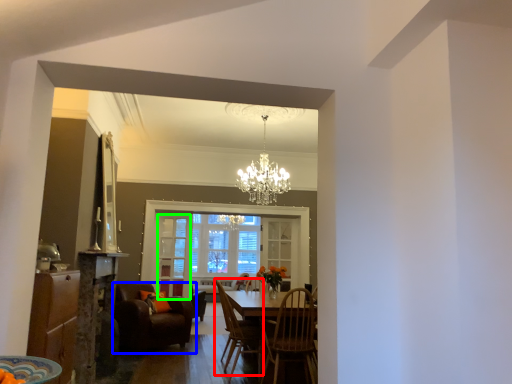
Question: Based on their relative distances, which object is farther from chair (highlighted by a red box)? Choose from chair (highlighted by a blue box) and glass door (highlighted by a green box).

Choices:
 (A) chair
 (B) glass door

Answer: (B)